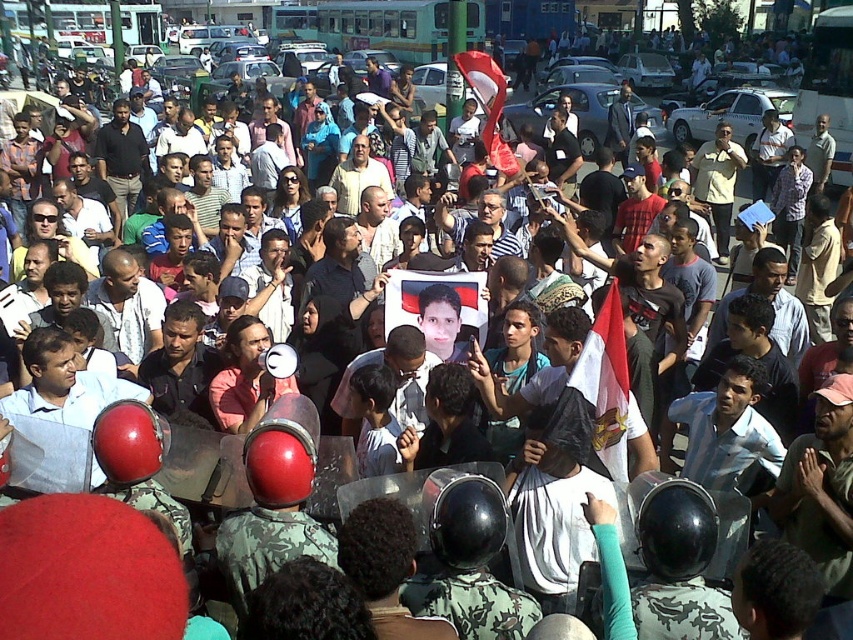
Between white fabric flag at center and red fabric flag at center, which one is positioned higher?

Positioned higher is red fabric flag at center.

Which is more to the left, white fabric flag at center or red fabric flag at center?

red fabric flag at center

Who is more distant from viewer, (595,321) or (399,321)?

The point (399,321) is more distant.

The width and height of the screenshot is (853, 640). In order to click on white fabric flag at center in this screenshot , I will do `click(596, 396)`.